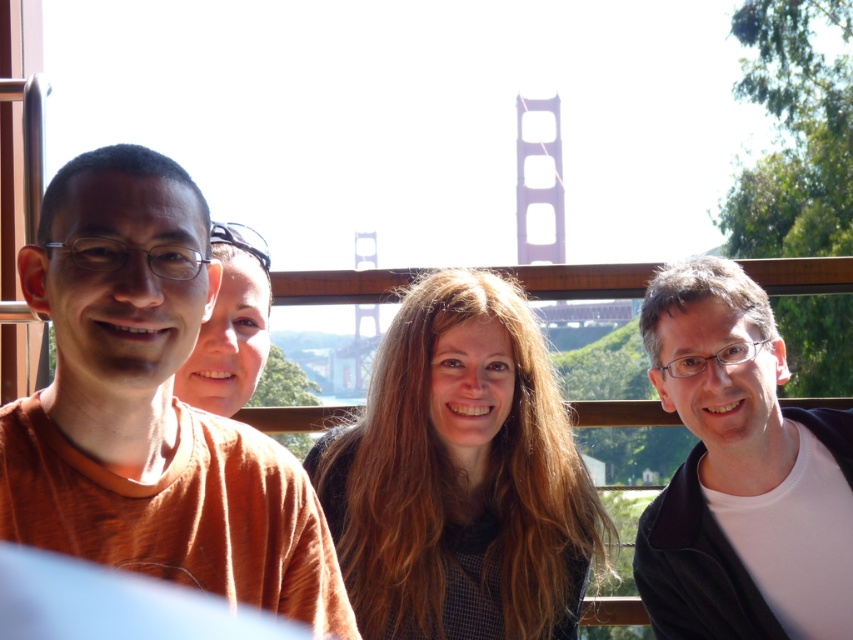
Question: Based on their relative distances, which object is nearer to the dark brown hair at center?

Choices:
 (A) white matte shirt at right
 (B) orange t-shirt at left

Answer: (A)

Question: Is dark brown hair at center further to camera compared to white matte shirt at right?

Choices:
 (A) yes
 (B) no

Answer: (B)

Question: Can you confirm if dark brown hair at center is bigger than white matte shirt at right?

Choices:
 (A) yes
 (B) no

Answer: (A)

Question: Is white matte shirt at right further to camera compared to smooth skin face at center?

Choices:
 (A) yes
 (B) no

Answer: (B)

Question: Which object is the farthest from the white matte shirt at right?

Choices:
 (A) smooth skin face at center
 (B) dark brown hair at center

Answer: (A)

Question: Which object is farther from the camera taking this photo?

Choices:
 (A) white matte shirt at right
 (B) smooth skin face at center
 (C) dark brown hair at center

Answer: (B)